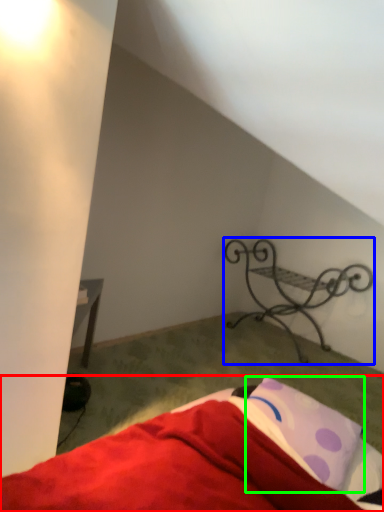
Question: Considering the real-world distances, which object is farthest from bed (highlighted by a red box)? furniture (highlighted by a blue box) or pillow (highlighted by a green box)?

Choices:
 (A) furniture
 (B) pillow

Answer: (A)